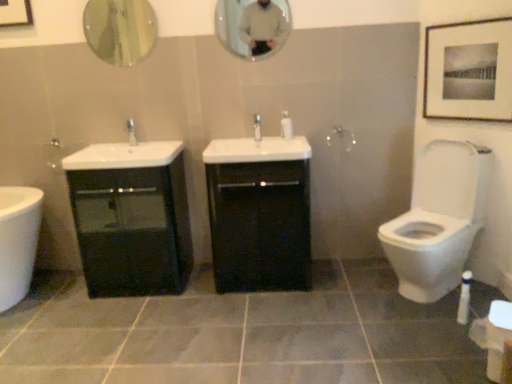
Locate an element on the screen. vacant space behind white plastic toothbrush at lower right is located at coordinates (443, 305).